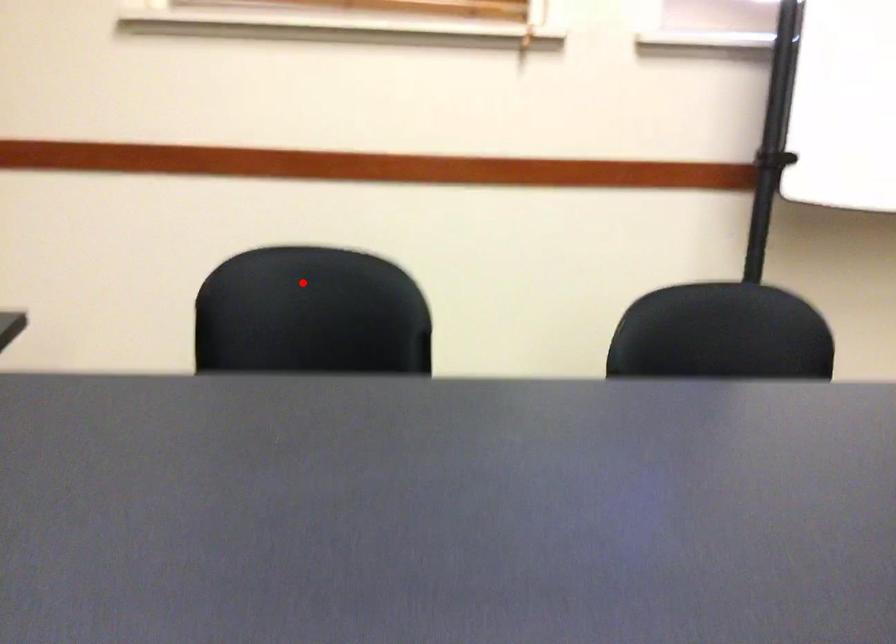
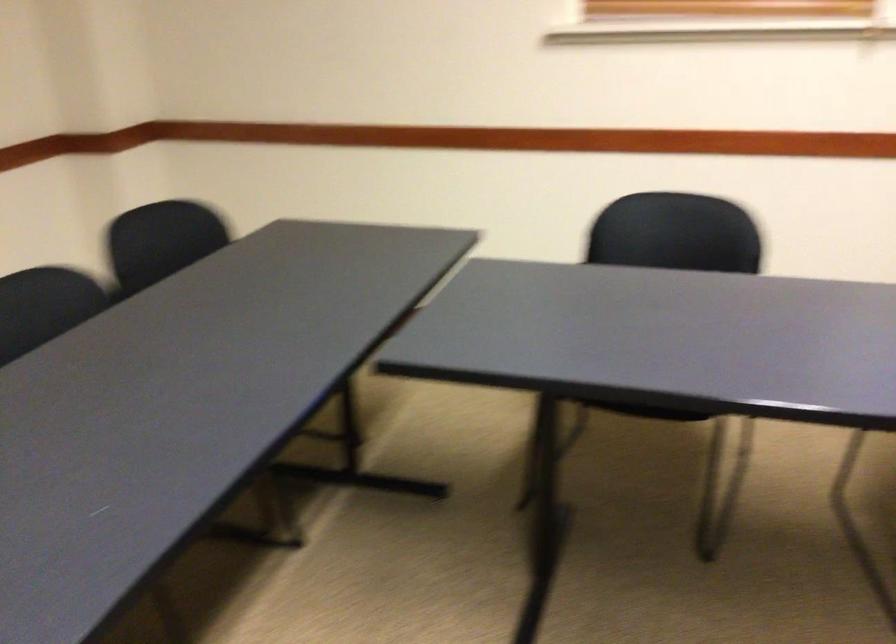
Question: I am providing you with two images of the same scene from different viewpoints. Image1 has a red point marked. In image2, the corresponding 3D location appears at what relative position? Reply with the corresponding letter.

Choices:
 (A) Closer
 (B) Farther

Answer: (B)